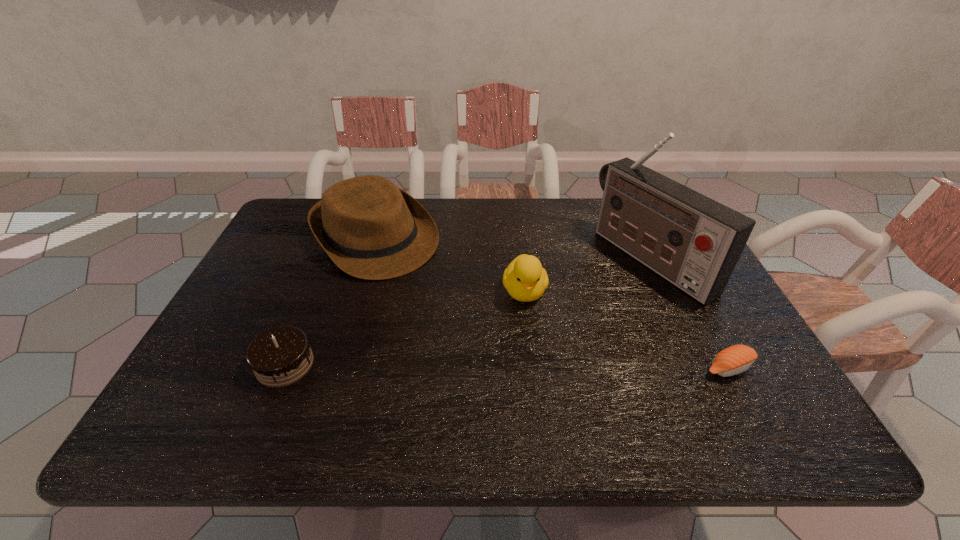
Where is `free space located 0.150m on the front-facing side of the third object from right to left`? free space located 0.150m on the front-facing side of the third object from right to left is located at coordinates (536, 360).

Where is `vacant position located on the front-facing side of the third object from right to left`? vacant position located on the front-facing side of the third object from right to left is located at coordinates (536, 360).

You are a GUI agent. You are given a task and a screenshot of the screen. Output one action in this format:
    pyautogui.click(x=<x>, y=<y>)
    Task: Click on the free space located 0.130m on the front-facing side of the third object from right to left
    
    Given the screenshot: What is the action you would take?
    pyautogui.click(x=535, y=353)

Where is `free space located 0.090m on the front panel of the tallest object`? The image size is (960, 540). free space located 0.090m on the front panel of the tallest object is located at coordinates pyautogui.click(x=593, y=296).

Where is `free space located on the front panel of the tallest object`? The width and height of the screenshot is (960, 540). free space located on the front panel of the tallest object is located at coordinates (593, 296).

The width and height of the screenshot is (960, 540). I want to click on vacant space located on the front panel of the tallest object, so click(x=515, y=338).

Image resolution: width=960 pixels, height=540 pixels. Find the location of `fedora situated at the far edge`. fedora situated at the far edge is located at coordinates (370, 229).

Where is `radio receiver that is at the far edge`? radio receiver that is at the far edge is located at coordinates (694, 242).

Where is `chocolate cake that is at the near edge`? chocolate cake that is at the near edge is located at coordinates (280, 356).

The image size is (960, 540). I want to click on sushi present at the near edge, so point(736,359).